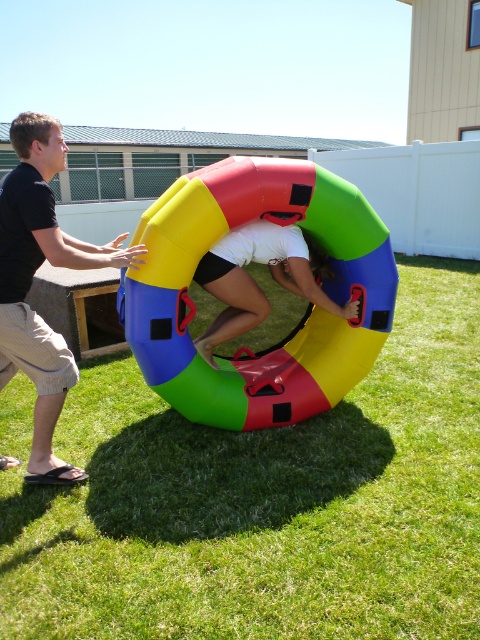
Question: Which point appears closest to the camera in this image?

Choices:
 (A) (26, 212)
 (B) (303, 224)
 (C) (251, 308)

Answer: (A)

Question: Can you confirm if black matte shirt at left is bigger than white matte shorts at center?

Choices:
 (A) no
 (B) yes

Answer: (B)

Question: Which of these objects is positioned farthest from the green grass at center?

Choices:
 (A) black matte shirt at left
 (B) multicolored inflatable ring at center

Answer: (A)

Question: Does green grass at center appear on the left side of multicolored inflatable ring at center?

Choices:
 (A) no
 (B) yes

Answer: (A)

Question: Is green grass at center closer to camera compared to multicolored inflatable ring at center?

Choices:
 (A) no
 (B) yes

Answer: (B)

Question: Among these points, which one is farthest from the camera?

Choices:
 (A) (315, 595)
 (B) (13, 266)

Answer: (B)